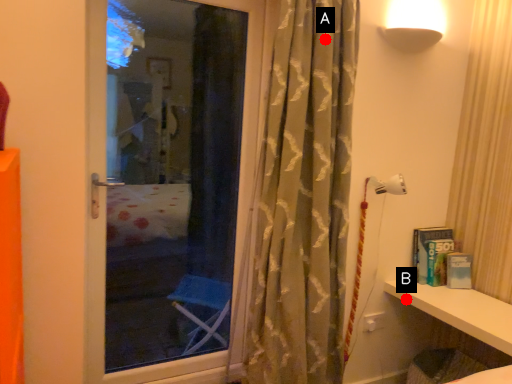
Question: Two points are circled on the image, labeled by A and B beside each circle. Which point is further to the camera?

Choices:
 (A) A is further
 (B) B is further

Answer: (B)